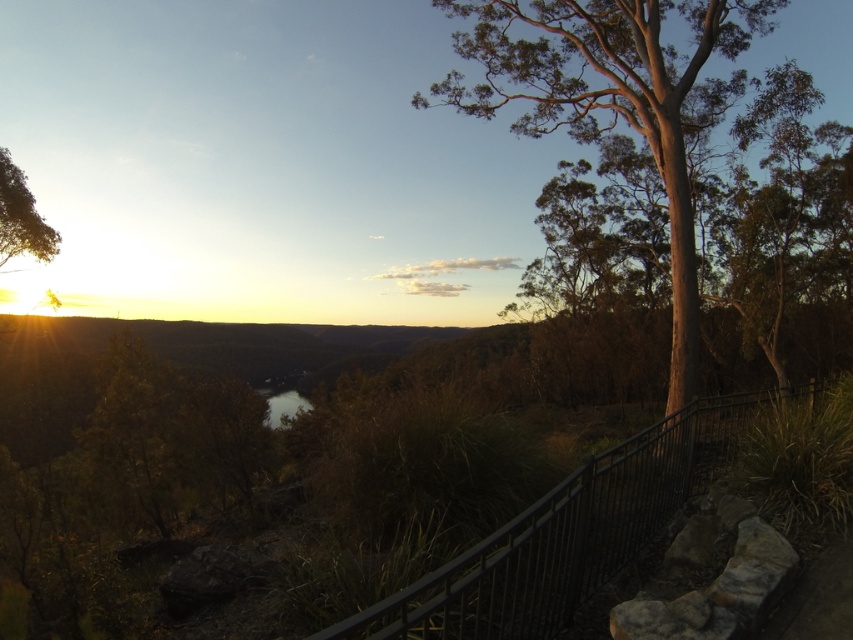
Question: Is metallic black railing at center in front of dark reflective water at center?

Choices:
 (A) yes
 (B) no

Answer: (A)

Question: Which of the following is the farthest from the observer?

Choices:
 (A) smooth bark tree at right
 (B) metallic black railing at center
 (C) dark reflective water at center

Answer: (C)

Question: Is smooth bark tree at right positioned at the back of metallic black railing at center?

Choices:
 (A) no
 (B) yes

Answer: (B)

Question: Which object is positioned farthest from the dark reflective water at center?

Choices:
 (A) smooth bark tree at right
 (B) metallic black railing at center

Answer: (B)

Question: Which point is farther to the camera?

Choices:
 (A) (271, 387)
 (B) (412, 634)
 (C) (596, 109)

Answer: (A)

Question: Is smooth bark tree at right to the left of dark reflective water at center from the viewer's perspective?

Choices:
 (A) yes
 (B) no

Answer: (B)